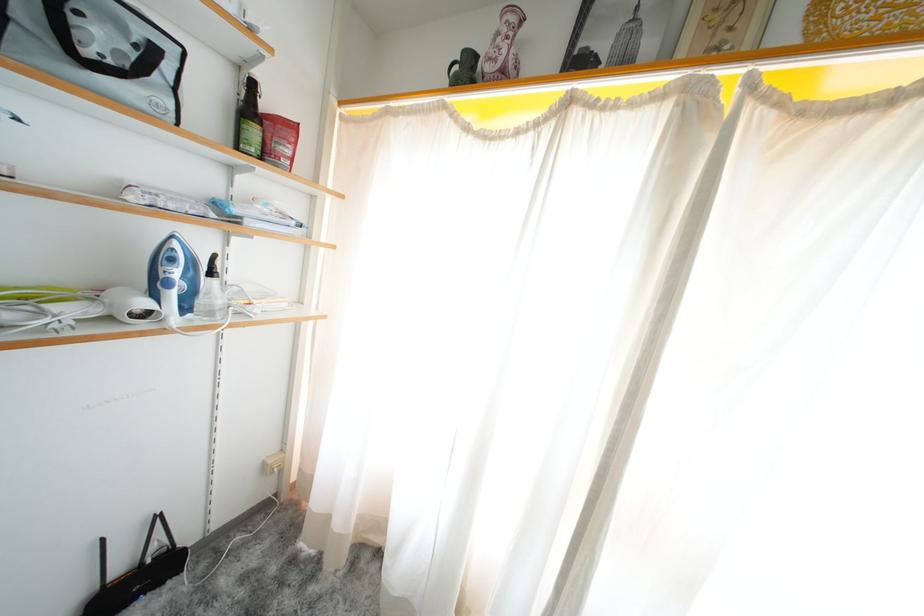
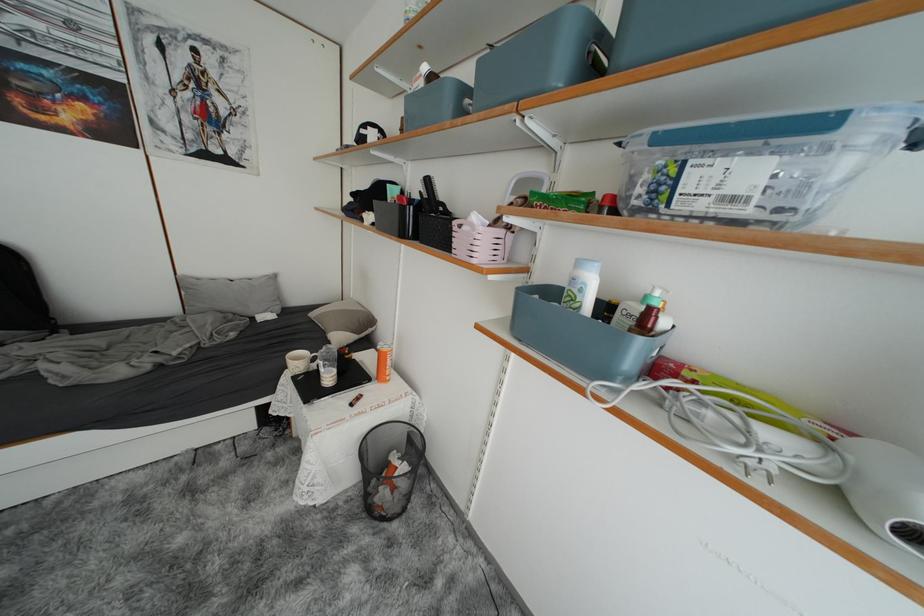
Question: The camera is either moving clockwise (left) or counter-clockwise (right) around the object. The first image is from the beginning of the video and the second image is from the end. Is the camera moving left or right when shooting the video?

Choices:
 (A) Left
 (B) Right

Answer: (B)